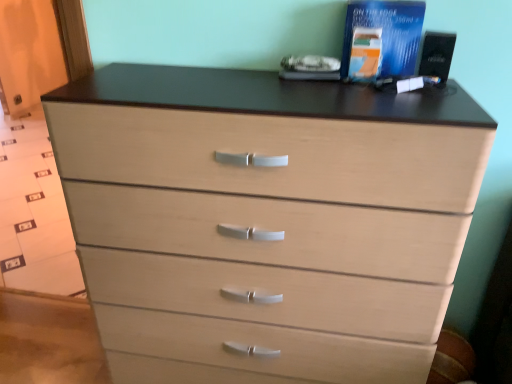
Where is `free space in front of blue paper at upper right, the second book in the right-to-left sequence`? Image resolution: width=512 pixels, height=384 pixels. free space in front of blue paper at upper right, the second book in the right-to-left sequence is located at coordinates (361, 98).